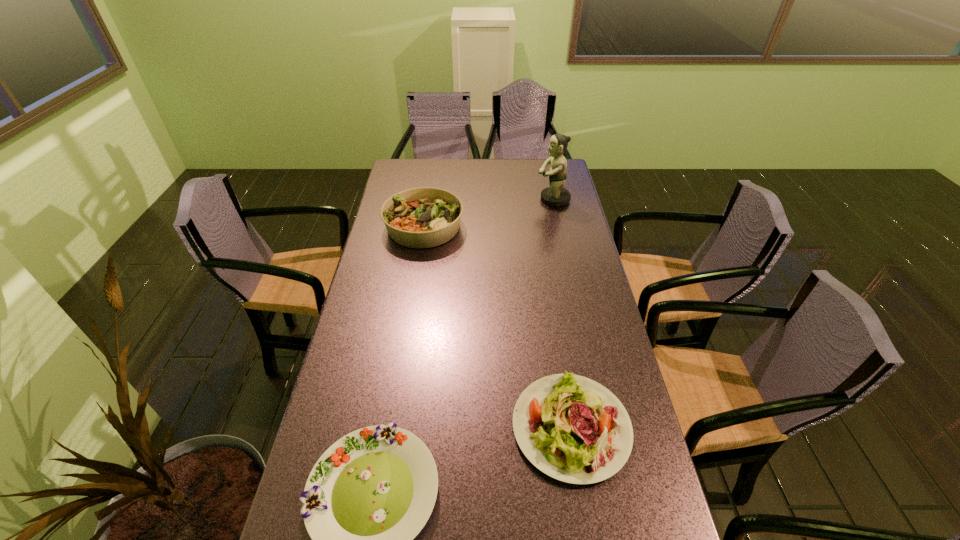
This screenshot has width=960, height=540. In order to click on free spot between the figurine and the rightmost salad plate in this screenshot , I will do `click(562, 313)`.

Where is `object that stands as the closest to the second tallest salad plate`? The height and width of the screenshot is (540, 960). object that stands as the closest to the second tallest salad plate is located at coordinates (368, 496).

Image resolution: width=960 pixels, height=540 pixels. In order to click on object that is the third closest one to the shortest object in this screenshot , I will do `click(555, 195)`.

Image resolution: width=960 pixels, height=540 pixels. What are the coordinates of `the second closest salad plate relative to the second tallest object` in the screenshot? It's located at (368, 496).

Select which salad plate appears as the second closest to the tallest salad plate. Please provide its 2D coordinates. Your answer should be formatted as a tuple, i.e. [(x, y)], where the tuple contains the x and y coordinates of a point satisfying the conditions above.

[(368, 496)]

You are a GUI agent. You are given a task and a screenshot of the screen. Output one action in this format:
    pyautogui.click(x=<x>, y=<y>)
    Task: Click on the free space in the image that satisfies the following two spatial constraints: 1. on the front-facing side of the figurine; 2. on the front side of the second shortest object
    The height and width of the screenshot is (540, 960).
    Given the screenshot: What is the action you would take?
    pyautogui.click(x=602, y=427)

Locate an element on the screen. Image resolution: width=960 pixels, height=540 pixels. free space that satisfies the following two spatial constraints: 1. on the front-facing side of the tallest object; 2. on the front side of the second shortest salad plate is located at coordinates (602, 427).